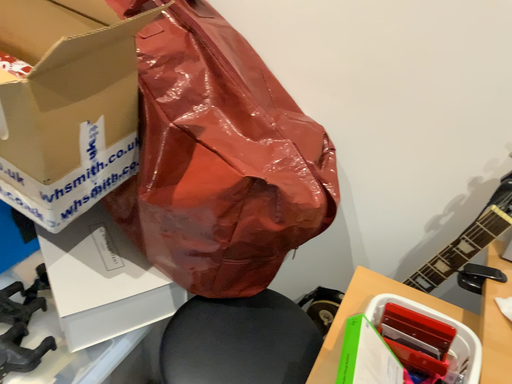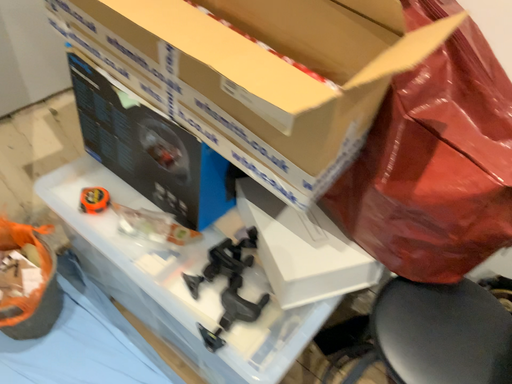
Question: Which way did the camera rotate in the video?

Choices:
 (A) rotated upward
 (B) rotated downward

Answer: (B)